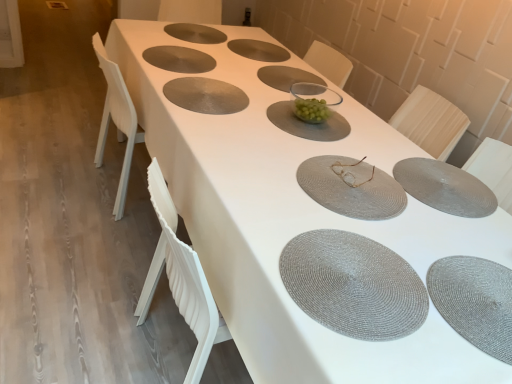
At what (x,y) coordinates should I click in order to perform the action: click on unoccupied area behind gray woven placemat at lower right, the 1th tableware from the bottom. Please return your answer as a coordinate pair (x, y). Looking at the image, I should click on (452, 222).